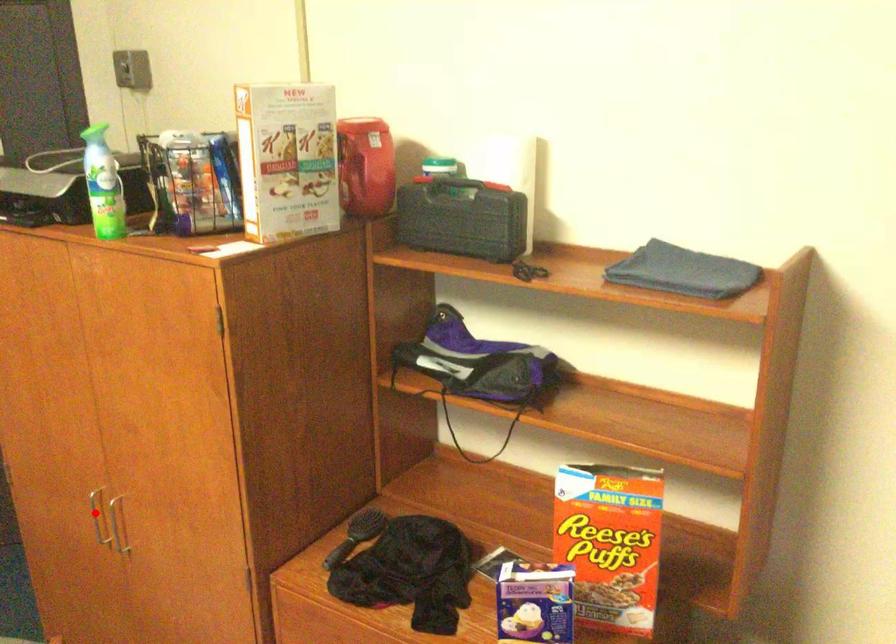
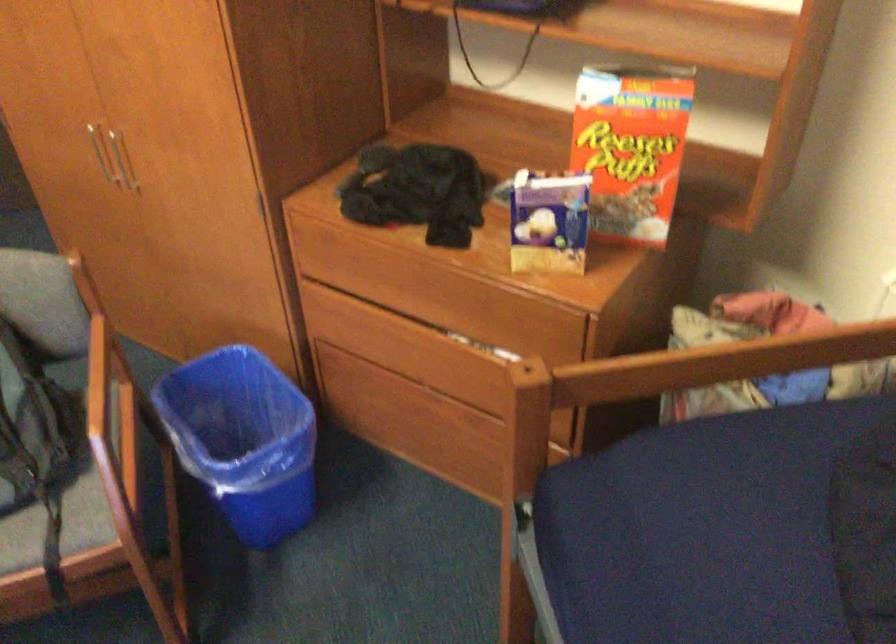
Find the pixel in the second image that matches the highlighted location in the first image.

(97, 149)